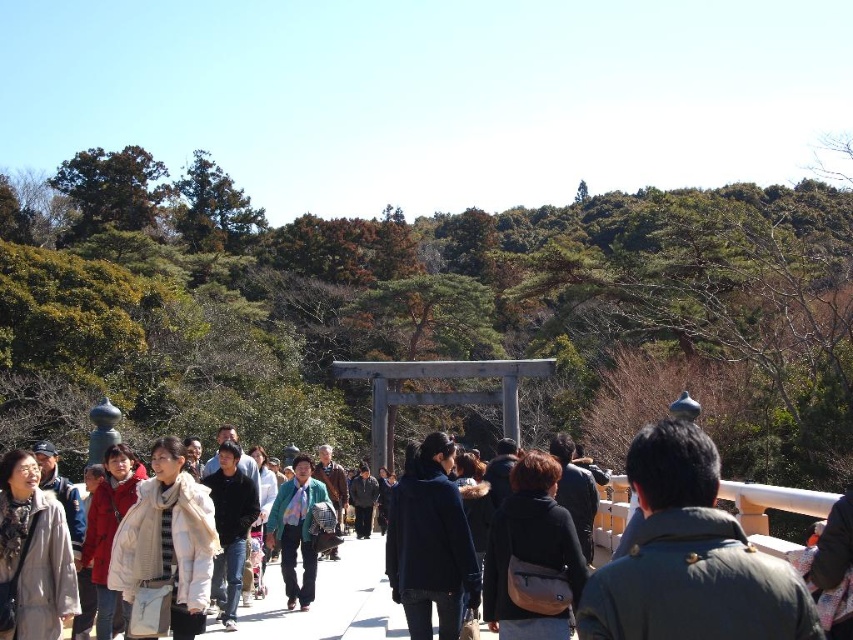
Which is more to the left, white fuzzy coat at center or light brown wool coat at lower left?

light brown wool coat at lower left

Does point (189, 506) come closer to viewer compared to point (65, 536)?

No, (189, 506) is behind (65, 536).

Is point (173, 493) positioned in front of point (45, 625)?

No, (173, 493) is behind (45, 625).

Identify the location of white fuzzy coat at center. (167, 540).

Which of these two, matte white coat at center or dark gray wool coat at center, stands shorter?

dark gray wool coat at center is shorter.

Who is taller, matte white coat at center or dark gray wool coat at center?

matte white coat at center

Image resolution: width=853 pixels, height=640 pixels. What do you see at coordinates (108, 532) in the screenshot?
I see `matte white coat at center` at bounding box center [108, 532].

At what (x,y) coordinates should I click in order to perform the action: click on matte white coat at center. Please return your answer as a coordinate pair (x, y). Image resolution: width=853 pixels, height=640 pixels. Looking at the image, I should click on (108, 532).

In the scene shown: Does green textured jacket at center appear on the left side of dark gray wool coat at center?

Correct, you'll find green textured jacket at center to the left of dark gray wool coat at center.

Does green textured jacket at center have a lesser height compared to dark gray wool coat at center?

Incorrect, green textured jacket at center's height does not fall short of dark gray wool coat at center's.

The width and height of the screenshot is (853, 640). What are the coordinates of `green textured jacket at center` in the screenshot? It's located at (296, 531).

Find the location of a particular element. This screenshot has height=640, width=853. green textured jacket at center is located at coordinates (296, 531).